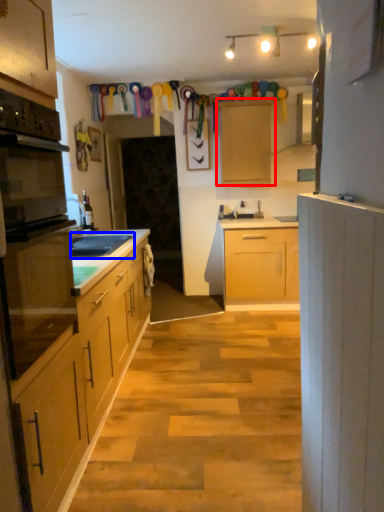
Question: Which object is further to the camera taking this photo, cabinetry (highlighted by a red box) or sink (highlighted by a blue box)?

Choices:
 (A) cabinetry
 (B) sink

Answer: (A)